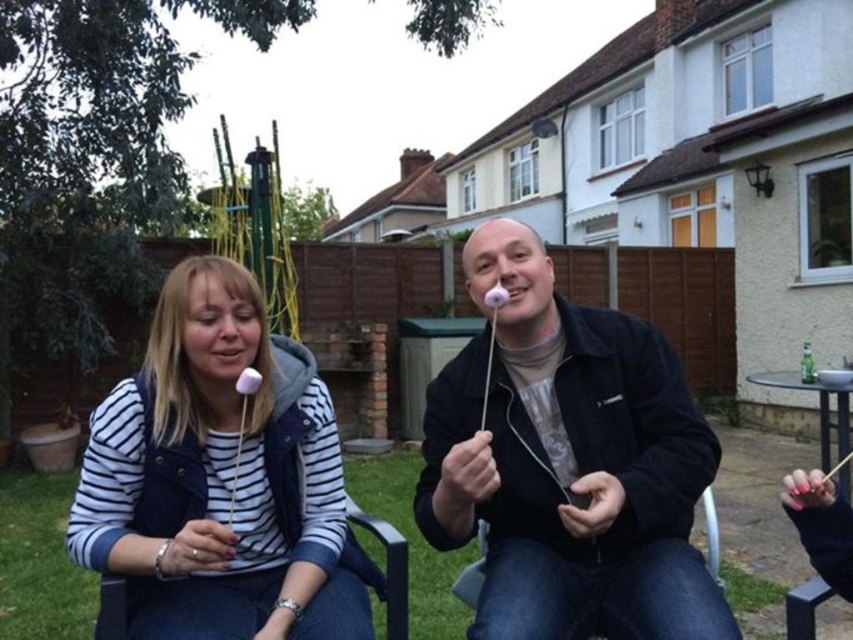
You are a photographer taking a picture of the scene. You want to ensure both the white matte marshmallow at center and the white striped shirt at center are clearly visible. Which object should you focus on first if you want to capture the one closer to the camera?

The white striped shirt at center is closer to the camera than the white matte marshmallow at center because the marshmallow is positioned to the right of the shirt, indicating it is further away.

You are a photographer trying to capture a candid shot of the two people roasting marshmallows. You notice the white marshmallow at center and the white striped shirt at center. Which object is located to the right of the other?

The white marshmallow at center is positioned on the right side of white striped shirt at center.

You are a photographer taking a picture of the scene. You need to ensure that the white matte marshmallow at center doesn not block the view of the white striped shirt at center. Is this possible given their positions?

The white matte marshmallow at center is located above the white striped shirt at center, so adjusting the camera angle slightly downward would allow the white striped shirt at center to be visible without obstruction from the marshmallow.